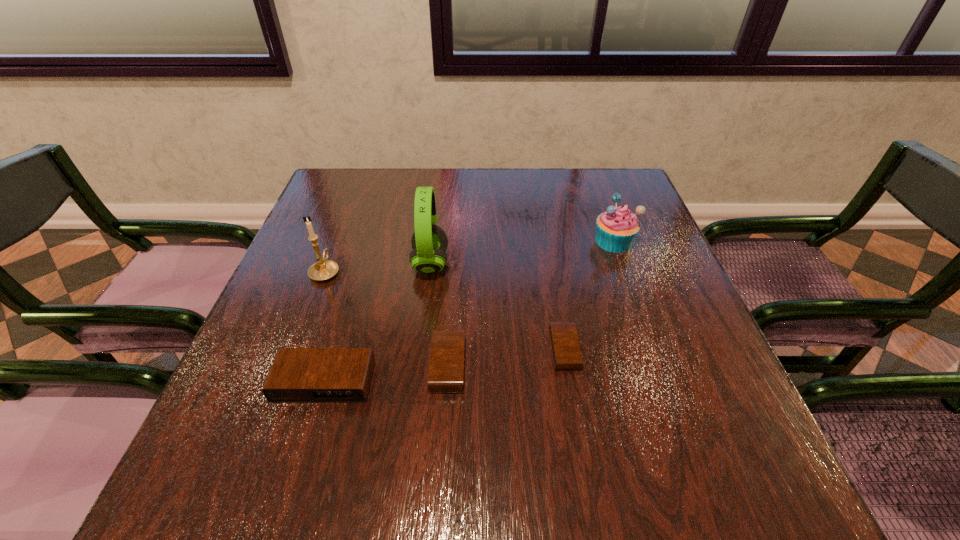
Where is `the tallest alarm clock`? The width and height of the screenshot is (960, 540). the tallest alarm clock is located at coordinates (298, 375).

The image size is (960, 540). What are the coordinates of `the leftmost alarm clock` in the screenshot? It's located at (298, 375).

Where is `the second shortest alarm clock`? This screenshot has height=540, width=960. the second shortest alarm clock is located at coordinates (447, 360).

Locate an element on the screen. The height and width of the screenshot is (540, 960). the fifth tallest object is located at coordinates (447, 360).

You are a GUI agent. You are given a task and a screenshot of the screen. Output one action in this format:
    pyautogui.click(x=<x>, y=<y>)
    Task: Click on the rightmost alarm clock
    
    Given the screenshot: What is the action you would take?
    pyautogui.click(x=566, y=352)

The height and width of the screenshot is (540, 960). I want to click on the second object from right to left, so click(x=566, y=352).

Locate an element on the screen. headset is located at coordinates (429, 242).

Identify the location of muffin. (617, 228).

Where is `the rightmost object`? The height and width of the screenshot is (540, 960). the rightmost object is located at coordinates (617, 228).

Image resolution: width=960 pixels, height=540 pixels. What are the coordinates of `the second tallest object` in the screenshot? It's located at (324, 269).